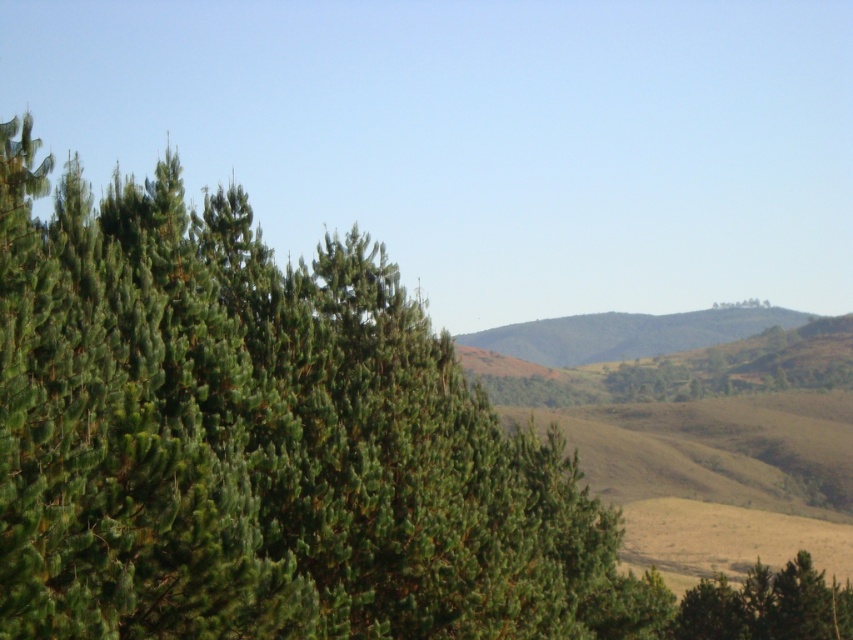
Who is higher up, green needle-like at left or green textured tree at lower right?

Positioned higher is green needle-like at left.

Image resolution: width=853 pixels, height=640 pixels. Describe the element at coordinates (262, 442) in the screenshot. I see `green needle-like at left` at that location.

This screenshot has height=640, width=853. What are the coordinates of `green needle-like at left` in the screenshot? It's located at (262, 442).